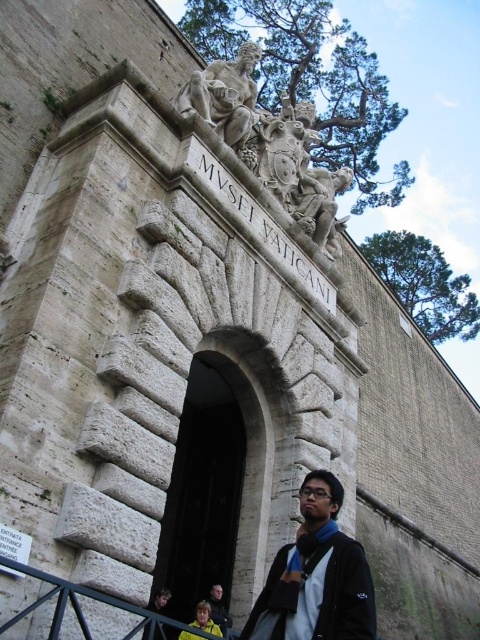
Who is shorter, white stone sculpture at upper center or white stone statue at upper center?

white stone statue at upper center

Is white stone sculpture at upper center to the left of white stone statue at upper center from the viewer's perspective?

No, white stone sculpture at upper center is not to the left of white stone statue at upper center.

Find the location of a particular element. white stone sculpture at upper center is located at coordinates (269, 141).

Where is `white stone sculpture at upper center`? This screenshot has width=480, height=640. white stone sculpture at upper center is located at coordinates (269, 141).

From the picture: Who is higher up, stone archway at center or yellow fabric at lower center?

stone archway at center

Between point (240, 442) and point (215, 630), which one is positioned behind?

The point (240, 442) is behind.

Does point (253, 477) come behind point (199, 627)?

Yes, it is behind point (199, 627).

This screenshot has height=640, width=480. I want to click on stone archway at center, so click(216, 492).

Is yellow fabric at lower center closer to camera compared to dark blue shirt at center?

That is True.

This screenshot has width=480, height=640. Describe the element at coordinates (204, 620) in the screenshot. I see `yellow fabric at lower center` at that location.

Locate an element on the screen. This screenshot has height=640, width=480. yellow fabric at lower center is located at coordinates (204, 620).